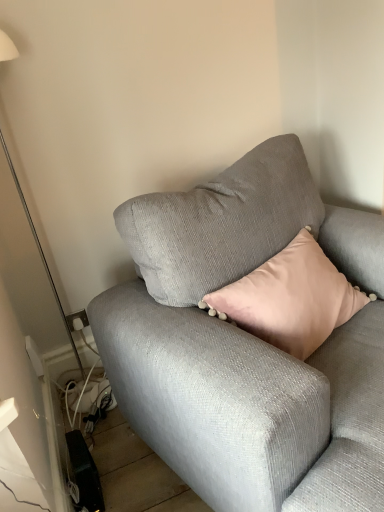
Where is `textured gray couch at center`? This screenshot has width=384, height=512. textured gray couch at center is located at coordinates (247, 344).

The width and height of the screenshot is (384, 512). What do you see at coordinates (247, 344) in the screenshot? I see `textured gray couch at center` at bounding box center [247, 344].

This screenshot has height=512, width=384. Identify the location of white glossy floor lamp at left. tap(41, 252).

This screenshot has height=512, width=384. What do you see at coordinates (41, 252) in the screenshot?
I see `white glossy floor lamp at left` at bounding box center [41, 252].

Consider the image. What is the approximate width of white glossy floor lamp at left?

white glossy floor lamp at left is 8.53 inches in width.

In order to click on textured gray couch at center in this screenshot , I will do `click(247, 344)`.

Considering the positions of objects textured gray couch at center and white glossy floor lamp at left in the image provided, who is more to the right, textured gray couch at center or white glossy floor lamp at left?

textured gray couch at center.

Relative to white glossy floor lamp at left, is textured gray couch at center in front or behind?

Visually, textured gray couch at center is located in front of white glossy floor lamp at left.

Is point (221, 243) less distant than point (2, 42)?

No.

From the image's perspective, is textured gray couch at center located above or below white glossy floor lamp at left?

From the image's perspective, textured gray couch at center appears below white glossy floor lamp at left.

From a real-world perspective, which is physically below, textured gray couch at center or white glossy floor lamp at left?

textured gray couch at center is physically lower.

Considering the sizes of textured gray couch at center and white glossy floor lamp at left in the image, is textured gray couch at center wider or thinner than white glossy floor lamp at left?

Considering their sizes, textured gray couch at center looks broader than white glossy floor lamp at left.

Does textured gray couch at center have a greater height compared to white glossy floor lamp at left?

No.

From the picture: In terms of size, does textured gray couch at center appear bigger or smaller than white glossy floor lamp at left?

textured gray couch at center is bigger than white glossy floor lamp at left.

Could white glossy floor lamp at left be considered to be inside textured gray couch at center?

No, white glossy floor lamp at left is not inside textured gray couch at center.

Is textured gray couch at center next to white glossy floor lamp at left?

No, textured gray couch at center is not touching white glossy floor lamp at left.

Is textured gray couch at center positioned with its back to white glossy floor lamp at left?

Yes, textured gray couch at center's orientation is away from white glossy floor lamp at left.

How different are the orientations of textured gray couch at center and white glossy floor lamp at left in degrees?

textured gray couch at center and white glossy floor lamp at left are facing 18.2 degrees away from each other.

Locate an element on the screen. The width and height of the screenshot is (384, 512). studio couch that is below the white glossy floor lamp at left (from the image's perspective) is located at coordinates (247, 344).

Can you confirm if white glossy floor lamp at left is positioned to the left of textured gray couch at center?

Indeed, white glossy floor lamp at left is positioned on the left side of textured gray couch at center.

Considering the relative positions of white glossy floor lamp at left and textured gray couch at center in the image provided, is white glossy floor lamp at left behind textured gray couch at center?

Yes, white glossy floor lamp at left is behind textured gray couch at center.

Which is in front, point (54, 295) or point (174, 250)?

The point (174, 250) is more forward.

From the image's perspective, who appears lower, white glossy floor lamp at left or textured gray couch at center?

textured gray couch at center is shown below in the image.

From the picture: From a real-world perspective, is white glossy floor lamp at left below textured gray couch at center?

No, from a real-world perspective, white glossy floor lamp at left is not below textured gray couch at center.

Looking at this image, which of these two, white glossy floor lamp at left or textured gray couch at center, is thinner?

white glossy floor lamp at left.

Considering the relative sizes of white glossy floor lamp at left and textured gray couch at center in the image provided, is white glossy floor lamp at left taller than textured gray couch at center?

Indeed, white glossy floor lamp at left has a greater height compared to textured gray couch at center.

Considering the sizes of objects white glossy floor lamp at left and textured gray couch at center in the image provided, who is smaller, white glossy floor lamp at left or textured gray couch at center?

white glossy floor lamp at left.

Which is correct: white glossy floor lamp at left is inside textured gray couch at center, or outside of it?

white glossy floor lamp at left is outside textured gray couch at center.

Would you say white glossy floor lamp at left is a long distance from textured gray couch at center?

white glossy floor lamp at left is near textured gray couch at center, not far away.

Is white glossy floor lamp at left turned away from textured gray couch at center?

No, white glossy floor lamp at left is not facing the opposite direction of textured gray couch at center.

Measure the distance between white glossy floor lamp at left and textured gray couch at center.

white glossy floor lamp at left is 84.71 centimeters away from textured gray couch at center.

This screenshot has height=512, width=384. What are the coordinates of `studio couch in front of the white glossy floor lamp at left` in the screenshot? It's located at (247, 344).

Image resolution: width=384 pixels, height=512 pixels. I want to click on table lamp located above the textured gray couch at center (from the image's perspective), so click(41, 252).

I want to click on studio couch in front of the white glossy floor lamp at left, so click(247, 344).